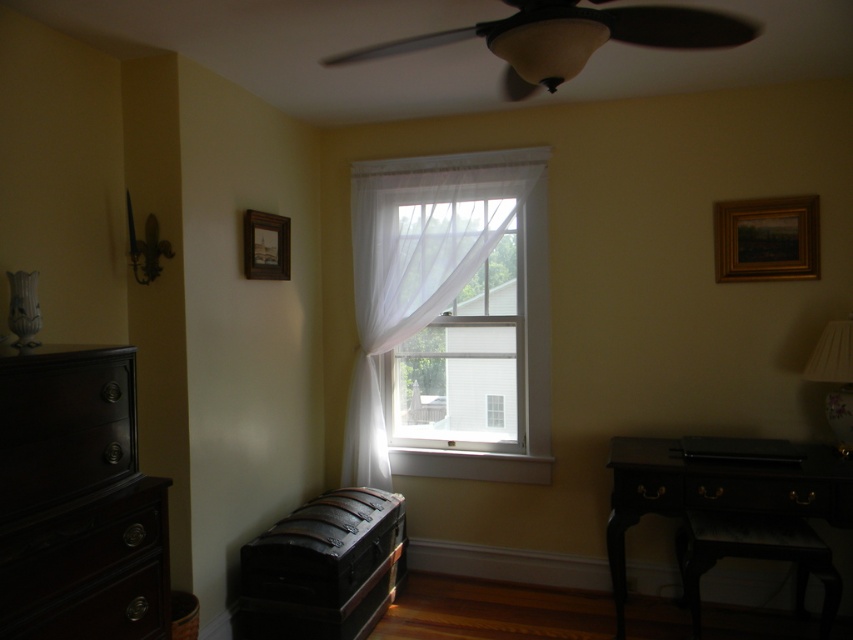
From the picture: Is dark wood drawer at left positioned in front of matte beige lampshade at upper center?

No, dark wood drawer at left is behind matte beige lampshade at upper center.

Between dark wood drawer at left and matte beige lampshade at upper center, which one is positioned higher?

matte beige lampshade at upper center is higher up.

Which is behind, point (120, 400) or point (492, 29)?

The point (120, 400) is behind.

Identify the location of dark wood drawer at left. The height and width of the screenshot is (640, 853). (62, 433).

Does black wood desk at lower right appear on the right side of gold metallic picture frame at upper right?

In fact, black wood desk at lower right is to the left of gold metallic picture frame at upper right.

What do you see at coordinates (730, 513) in the screenshot? I see `black wood desk at lower right` at bounding box center [730, 513].

I want to click on black wood desk at lower right, so click(730, 513).

Between point (76, 593) and point (805, 518), which one is positioned behind?

Point (805, 518)

Is dark wood dresser at left to the left of black wood desk at lower right from the viewer's perspective?

Yes, dark wood dresser at left is to the left of black wood desk at lower right.

Between point (114, 532) and point (691, 516), which one is positioned behind?

The point (691, 516) is behind.

This screenshot has height=640, width=853. I want to click on dark wood dresser at left, so click(77, 500).